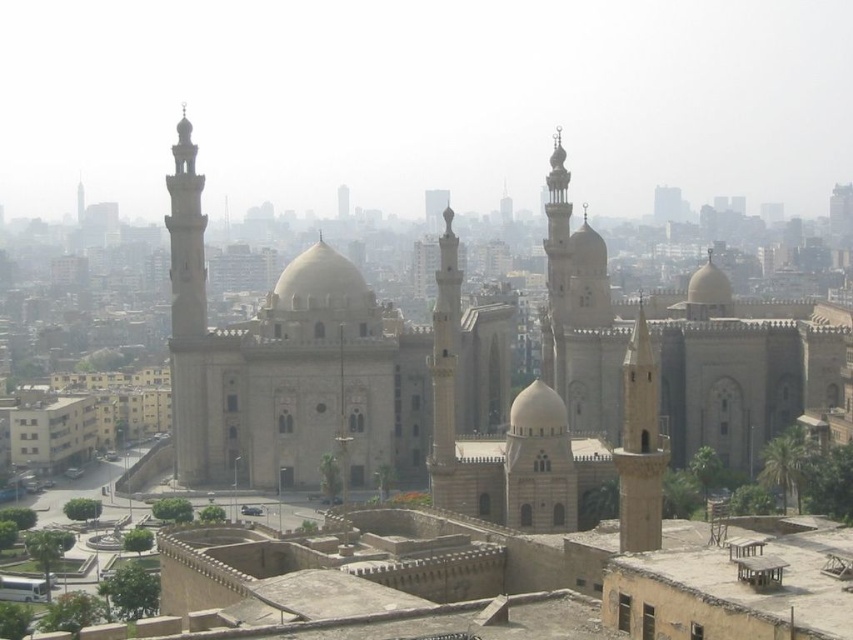
Who is taller, beige stone minaret at center right or light beige stone minaret at left?

With more height is beige stone minaret at center right.

Measure the distance between point (553, 317) and camera.

Point (553, 317) is 691.67 feet from camera.

You are a GUI agent. You are given a task and a screenshot of the screen. Output one action in this format:
    pyautogui.click(x=<x>, y=<y>)
    Task: Click on the beige stone minaret at center right
    This screenshot has width=853, height=640.
    Given the screenshot: What is the action you would take?
    coord(579,314)

Could you measure the distance between beige stone minaret at center right and light beige stone minaret at center-right?

A distance of 101.37 feet exists between beige stone minaret at center right and light beige stone minaret at center-right.

Is point (552, 253) farther from viewer compared to point (630, 532)?

Yes, point (552, 253) is behind point (630, 532).

Find the location of a particular element. The image size is (853, 640). beige stone minaret at center right is located at coordinates (x=579, y=314).

Is point (654, 404) closer to camera compared to point (175, 332)?

Yes, point (654, 404) is closer to viewer.

Which is more to the left, light beige stone minaret at center-right or light beige stone minaret at left?

Positioned to the left is light beige stone minaret at left.

Is point (654, 454) in front of point (186, 147)?

Yes, it is.

Image resolution: width=853 pixels, height=640 pixels. In order to click on light beige stone minaret at center-right in this screenshot , I will do `click(640, 445)`.